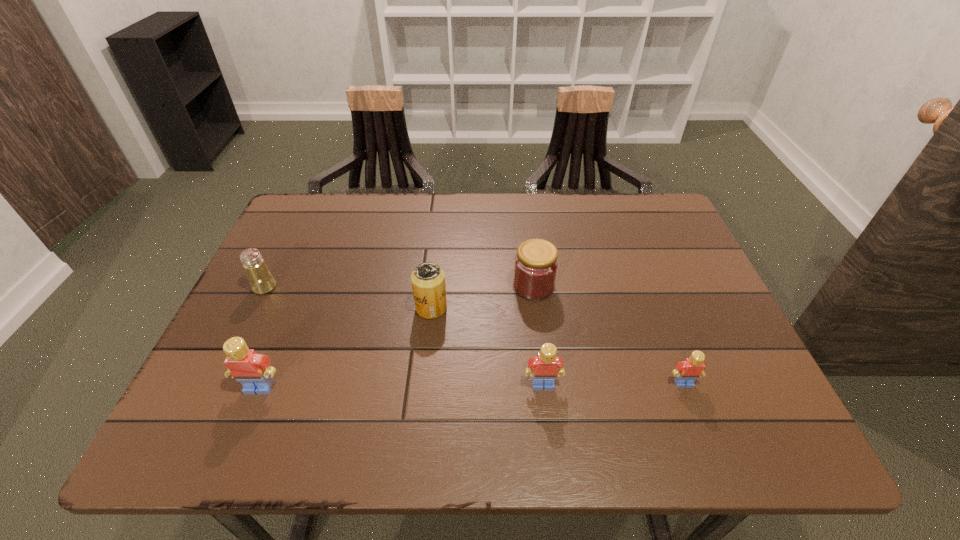
Where is `free space at the far left corner`? The width and height of the screenshot is (960, 540). free space at the far left corner is located at coordinates point(332,240).

This screenshot has width=960, height=540. I want to click on vacant space at the far right corner of the desktop, so click(672, 226).

Image resolution: width=960 pixels, height=540 pixels. In order to click on free space between the jam and the second shortest Lego in this screenshot , I will do (539, 335).

Where is `vacant space that's between the shortest Lego and the beer can`? vacant space that's between the shortest Lego and the beer can is located at coordinates (558, 346).

Identify the location of free space between the leftmost object and the rightmost Lego. (474, 335).

Identify the location of free spot between the second tallest Lego and the saltshaker. (404, 336).

Locate an element on the screen. The width and height of the screenshot is (960, 540). vacant area that lies between the beer can and the shortest Lego is located at coordinates (558, 346).

At what (x,y) coordinates should I click in order to perform the action: click on vacant space that's between the leftmost Lego and the beer can. Please return your answer as a coordinate pair (x, y). Looking at the image, I should click on (346, 348).

Find the location of a particular element. The width and height of the screenshot is (960, 540). free spot between the shortest Lego and the saltshaker is located at coordinates (474, 335).

Locate an element on the screen. This screenshot has width=960, height=540. blank region between the jam and the second object from left to right is located at coordinates (396, 336).